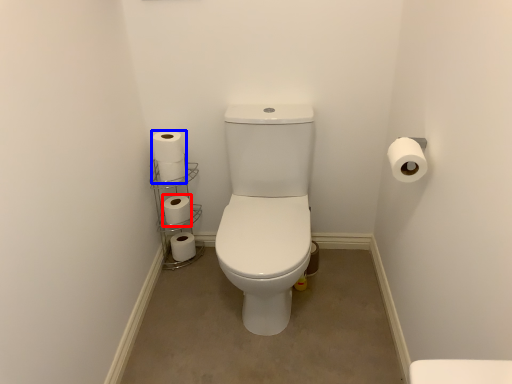
Question: Which of the following is the closest to the observer, toilet paper (highlighted by a red box) or toilet paper (highlighted by a blue box)?

Choices:
 (A) toilet paper
 (B) toilet paper

Answer: (B)